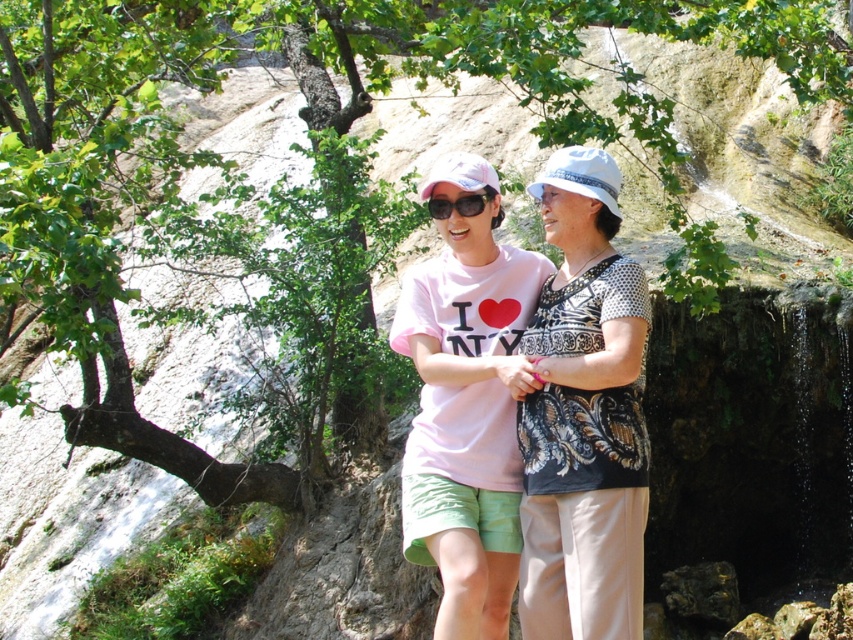
You are standing in the rocky area and want to place a small flag at point A and point B. If point A is at coordinates point [405,499] and point B is at coordinates point [500,218], which point is closer to you?

Point A at coordinates point [405,499] is closer to you than point B at coordinates point [500,218].